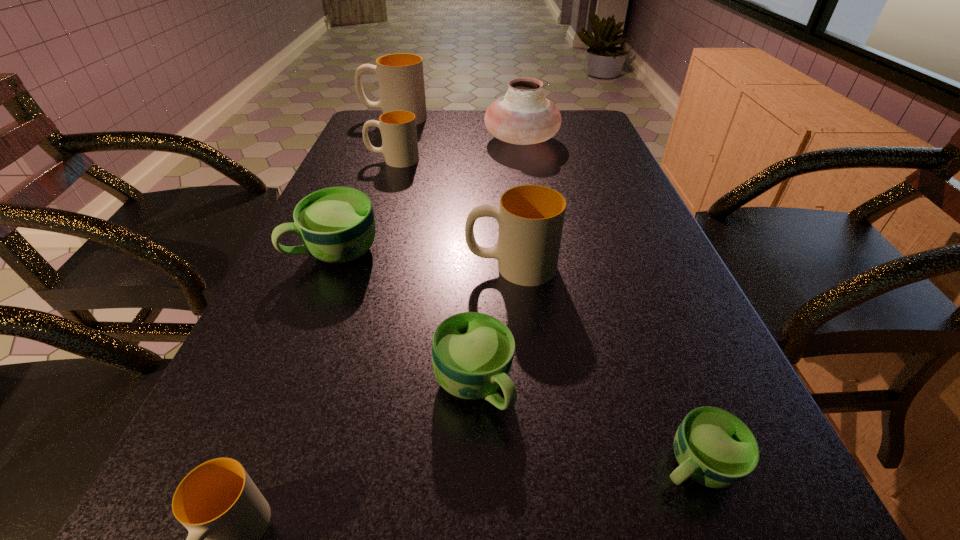
This screenshot has width=960, height=540. I want to click on vacant region between the leftmost blue cup and the farthest yellow cup, so tap(365, 185).

Image resolution: width=960 pixels, height=540 pixels. I want to click on vacant space that is in between the second biggest yellow cup and the farthest blue cup, so click(423, 259).

Locate an element on the screen. free space between the shortest object and the sixth shortest cup is located at coordinates (603, 366).

I want to click on free space between the pottery and the rightmost blue cup, so click(609, 303).

The image size is (960, 540). Identify the location of vacant region between the fifth farthest cup and the sixth nearest cup. (433, 273).

Where is `object that is the seventh closest to the farthest yellow cup`? The height and width of the screenshot is (540, 960). object that is the seventh closest to the farthest yellow cup is located at coordinates (226, 515).

Locate which object is the second closest to the nearest yellow cup. Please provide its 2D coordinates. Your answer should be formatted as a tuple, i.e. [(x, y)], where the tuple contains the x and y coordinates of a point satisfying the conditions above.

[(337, 225)]

At what (x,y) coordinates should I click in order to perform the action: click on the fifth closest cup to the third nearest cup. Please return your answer as a coordinate pair (x, y). The image size is (960, 540). Looking at the image, I should click on (x=398, y=128).

Locate which cup is the third closest to the farthest yellow cup. Please provide its 2D coordinates. Your answer should be formatted as a tuple, i.e. [(x, y)], where the tuple contains the x and y coordinates of a point satisfying the conditions above.

[(530, 217)]

Locate which yellow cup is the closest to the smallest yellow cup. Please provide its 2D coordinates. Your answer should be formatted as a tuple, i.e. [(x, y)], where the tuple contains the x and y coordinates of a point satisfying the conditions above.

[(530, 217)]